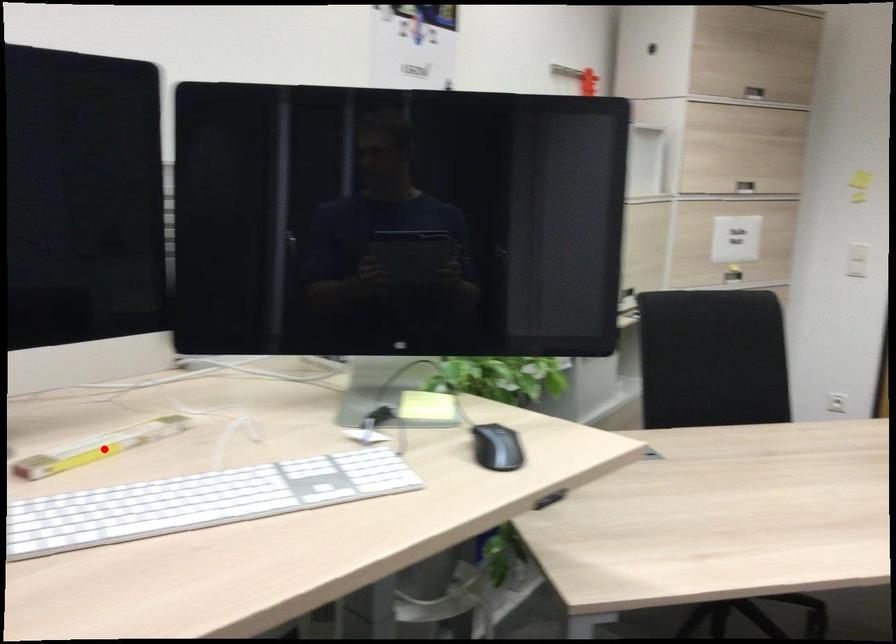
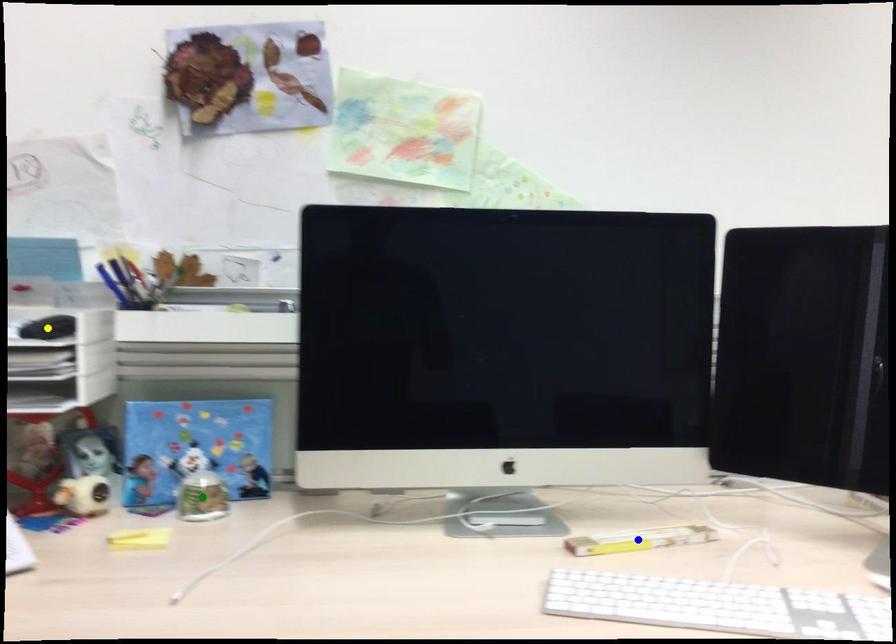
Question: I am providing you with two images of the same scene from different viewpoints. A red point is marked on the first image. You are given multiple points on the second image. Which mark in image 2 goes with the point in image 1?

Choices:
 (A) yellow point
 (B) green point
 (C) blue point

Answer: (C)